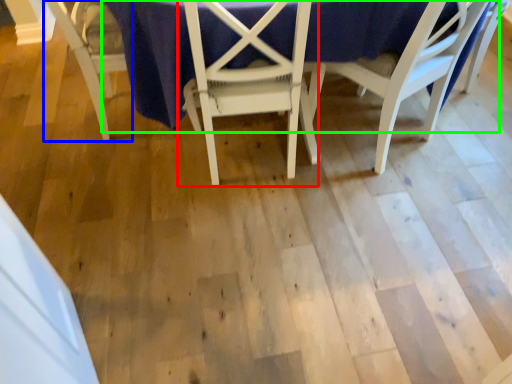
Question: Estimate the real-world distances between objects in this image. Which object is closer to chair (highlighted by a red box), chair (highlighted by a blue box) or table (highlighted by a green box)?

Choices:
 (A) chair
 (B) table

Answer: (B)